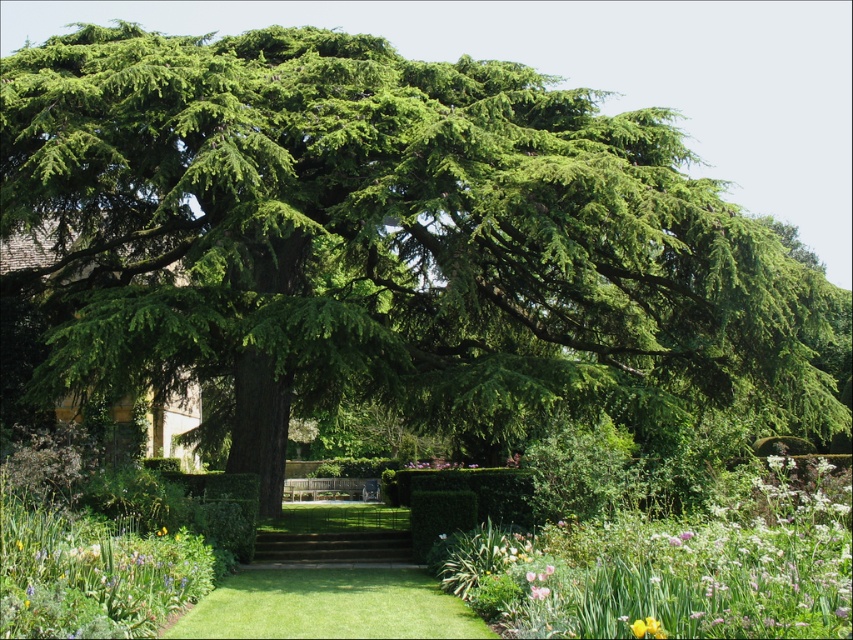
Between brown wooden stairs at center and soft pink petal at center, which one is positioned lower?

brown wooden stairs at center is below.

Is brown wooden stairs at center wider than soft pink petal at center?

Indeed, brown wooden stairs at center has a greater width compared to soft pink petal at center.

Does point (277, 532) lie in front of point (544, 592)?

No, it is not.

Locate an element on the screen. brown wooden stairs at center is located at coordinates (334, 548).

Is point (660, 632) farther from viewer compared to point (537, 595)?

No, it is in front of (537, 595).

Can you confirm if yellow matte flower at lower right is bigger than soft pink petal at center?

No, yellow matte flower at lower right is not bigger than soft pink petal at center.

Is point (662, 634) more distant than point (546, 588)?

No, it is in front of (546, 588).

The width and height of the screenshot is (853, 640). I want to click on yellow matte flower at lower right, so click(x=647, y=627).

Between brown wooden stairs at center and yellow matte flower at lower right, which one is positioned higher?

Positioned higher is yellow matte flower at lower right.

Is point (292, 538) behind point (635, 630)?

Yes, point (292, 538) is farther from viewer.

Identify the location of brown wooden stairs at center. (334, 548).